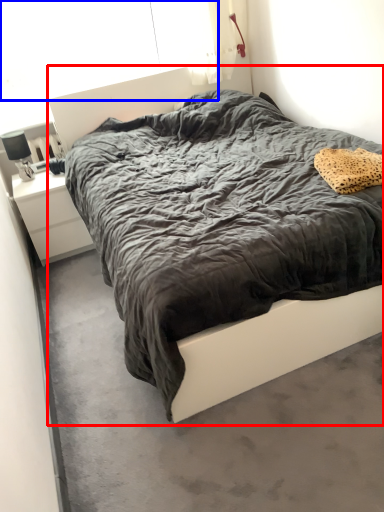
Question: Among these objects, which one is farthest to the camera, bed (highlighted by a red box) or window screen (highlighted by a blue box)?

Choices:
 (A) bed
 (B) window screen

Answer: (B)